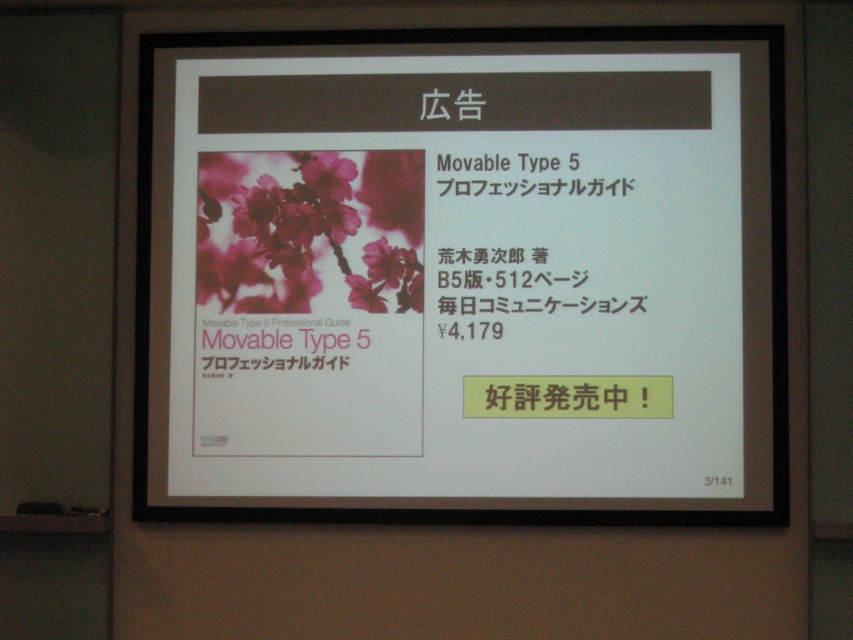
Is matte paper cover at center further to the viewer compared to pink matte text at center?

No, matte paper cover at center is closer to the viewer.

Is point (526, 336) behind point (212, 372)?

No, it is in front of (212, 372).

Is point (548, 211) behind point (199, 348)?

No, (548, 211) is closer to viewer.

Find the location of a particular element. The height and width of the screenshot is (640, 853). matte paper cover at center is located at coordinates (463, 275).